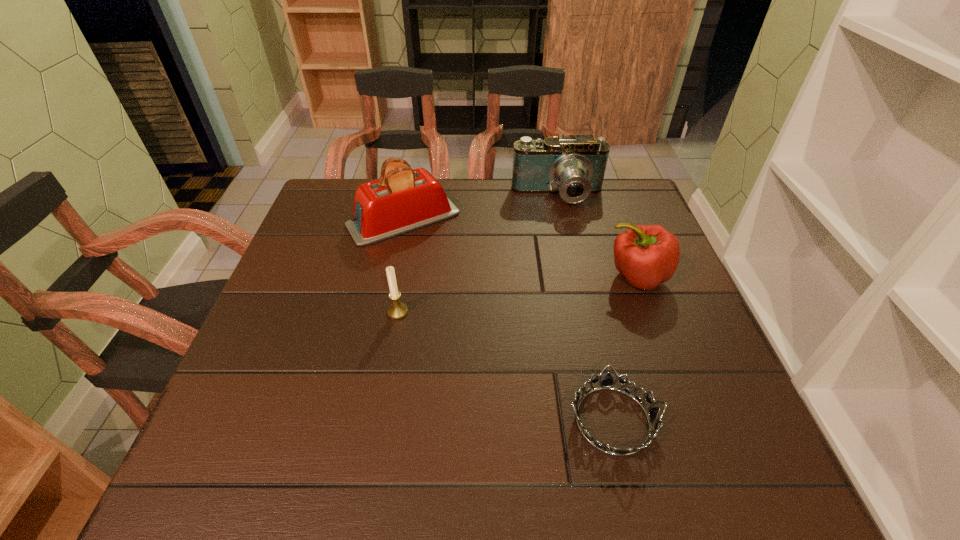
Locate an element on the screen. The width and height of the screenshot is (960, 540). toaster is located at coordinates (402, 199).

Identify the location of camcorder. The image size is (960, 540). point(573,166).

Identify the location of bell pepper. (646, 255).

The image size is (960, 540). I want to click on the second nearest object, so click(397, 310).

You are a GUI agent. You are given a task and a screenshot of the screen. Output one action in this format:
    pyautogui.click(x=<x>, y=<y>)
    Task: Click on the tiara
    Image resolution: width=960 pixels, height=540 pixels.
    Given the screenshot: What is the action you would take?
    click(x=607, y=383)

This screenshot has height=540, width=960. I want to click on the shortest object, so click(607, 383).

The width and height of the screenshot is (960, 540). I want to click on free region located 0.090m on the right of the toaster, so click(492, 220).

This screenshot has width=960, height=540. I want to click on vacant region located on the front-facing side of the camcorder, so click(x=580, y=292).

I want to click on vacant area situated 0.240m on the left of the third nearest object, so click(x=506, y=276).

The width and height of the screenshot is (960, 540). I want to click on vacant position located 0.170m on the left of the candle holder, so click(311, 312).